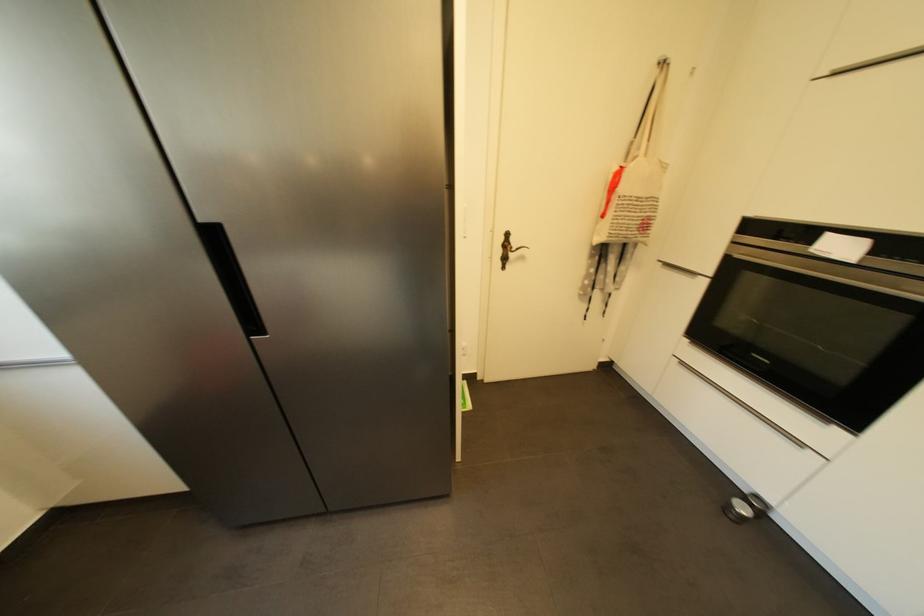
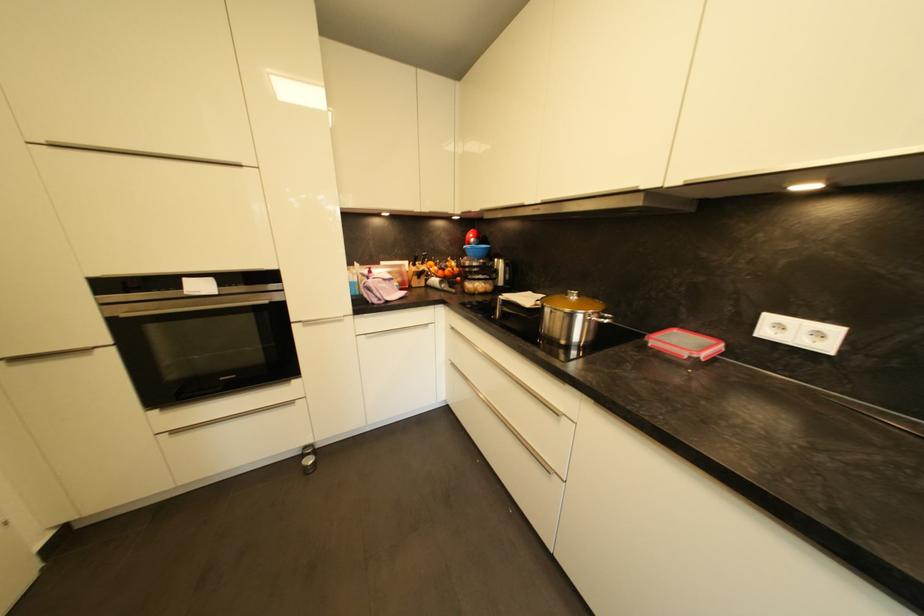
Based on the continuous images, in which direction is the camera rotating?

The camera rotated toward right-down.